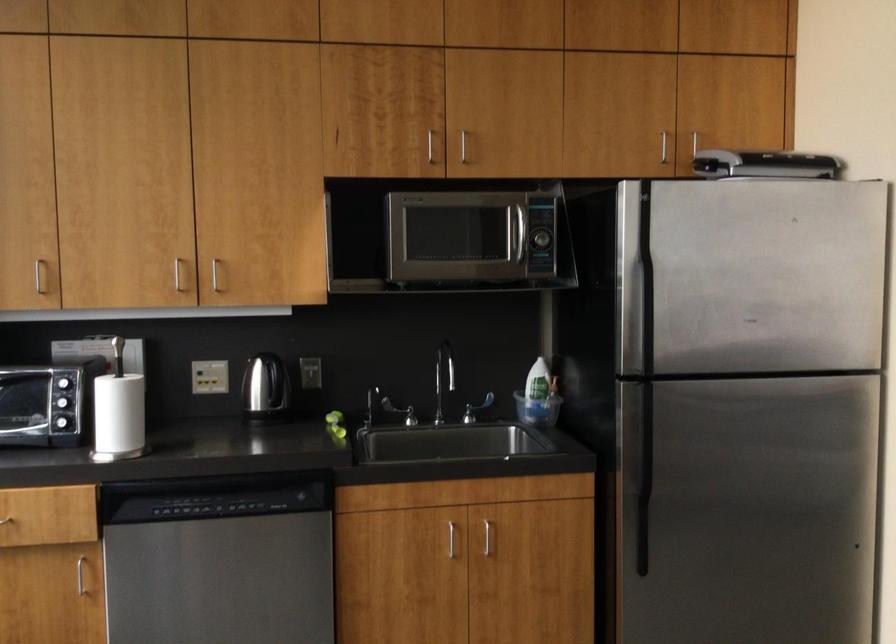
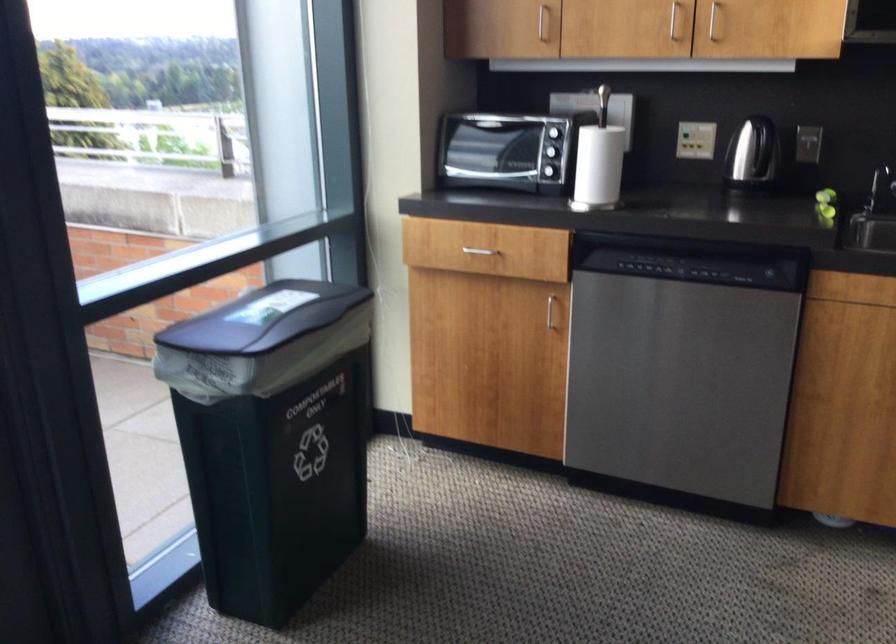
The point at (85, 576) is marked in the first image. Where is the corresponding point in the second image?

(549, 310)